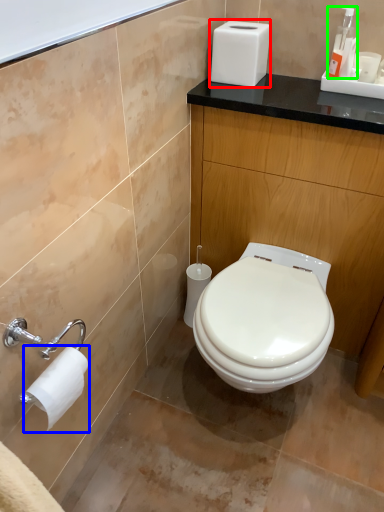
Question: Estimate the real-world distances between objects in this image. Which object is farther from appliance (highlighted by a red box), toilet paper (highlighted by a blue box) or soap dispenser (highlighted by a green box)?

Choices:
 (A) toilet paper
 (B) soap dispenser

Answer: (A)